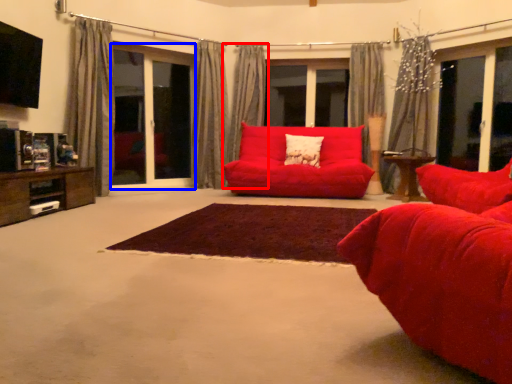
Question: Among these objects, which one is farthest to the camera, curtain (highlighted by a red box) or screen door (highlighted by a blue box)?

Choices:
 (A) curtain
 (B) screen door

Answer: (A)